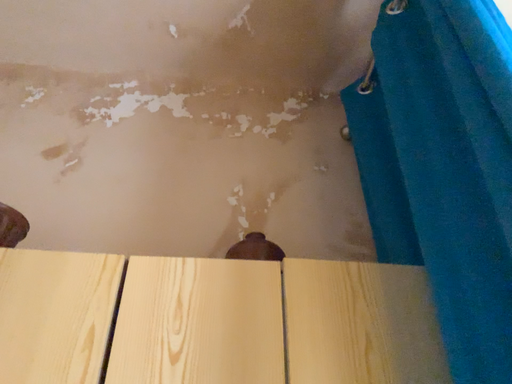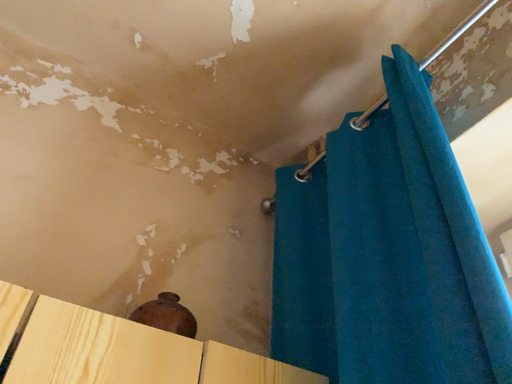
Question: Which way did the camera rotate in the video?

Choices:
 (A) rotated left
 (B) rotated right

Answer: (B)